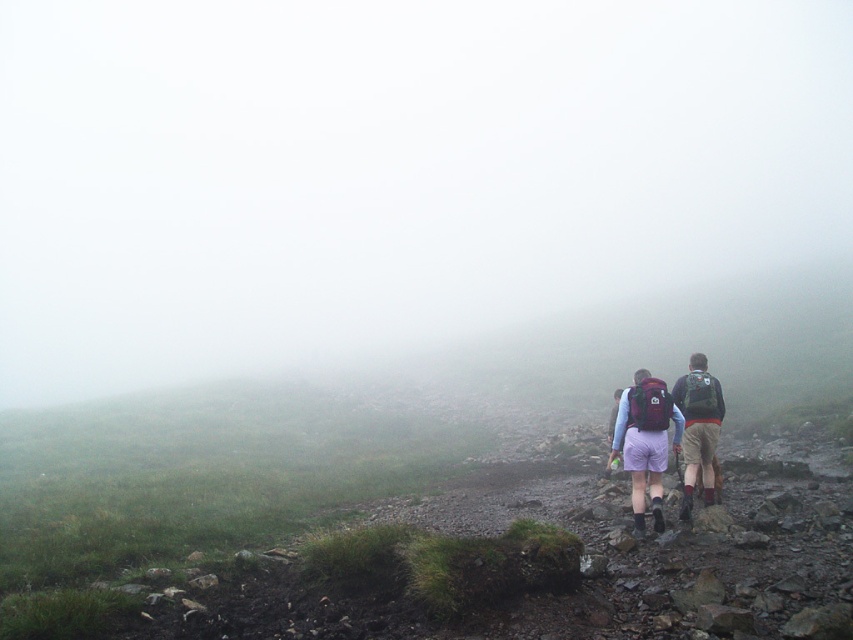
Which is above, matte purple shorts at center or dark green backpack at right?

Positioned higher is dark green backpack at right.

Can you confirm if matte purple shorts at center is positioned below dark green backpack at right?

Indeed, matte purple shorts at center is positioned under dark green backpack at right.

Locate an element on the screen. matte purple shorts at center is located at coordinates (697, 426).